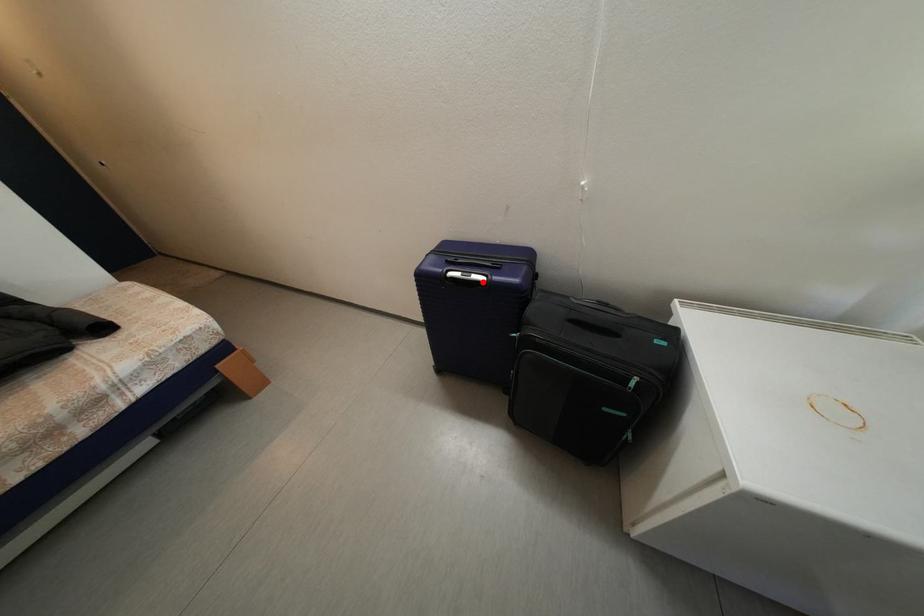
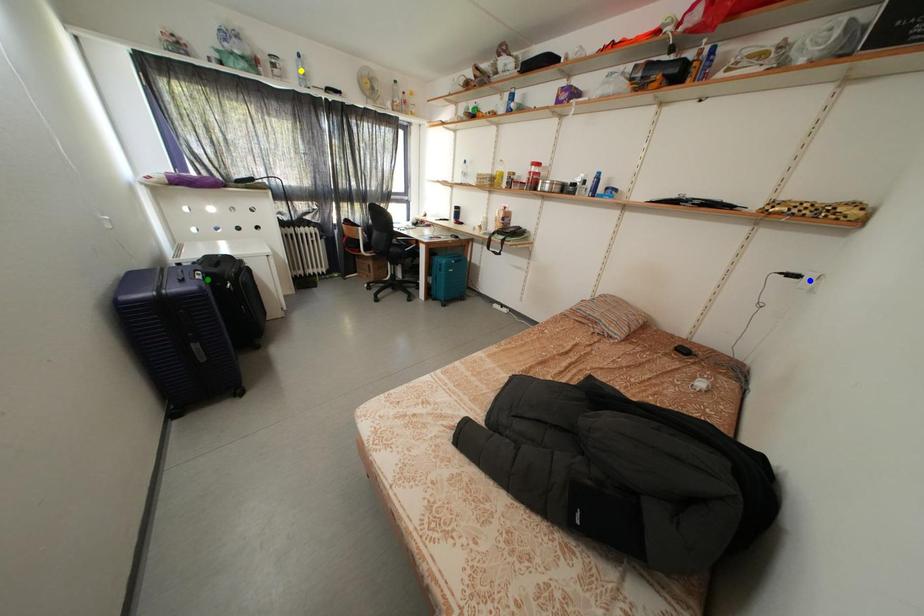
Question: I am providing you with two images of the same scene from different viewpoints. A red point is marked on the first image. You are given multiple points on the second image. Which spot in image 2 lines up with the point in image 1?

Choices:
 (A) green point
 (B) yellow point
 (C) blue point

Answer: (A)